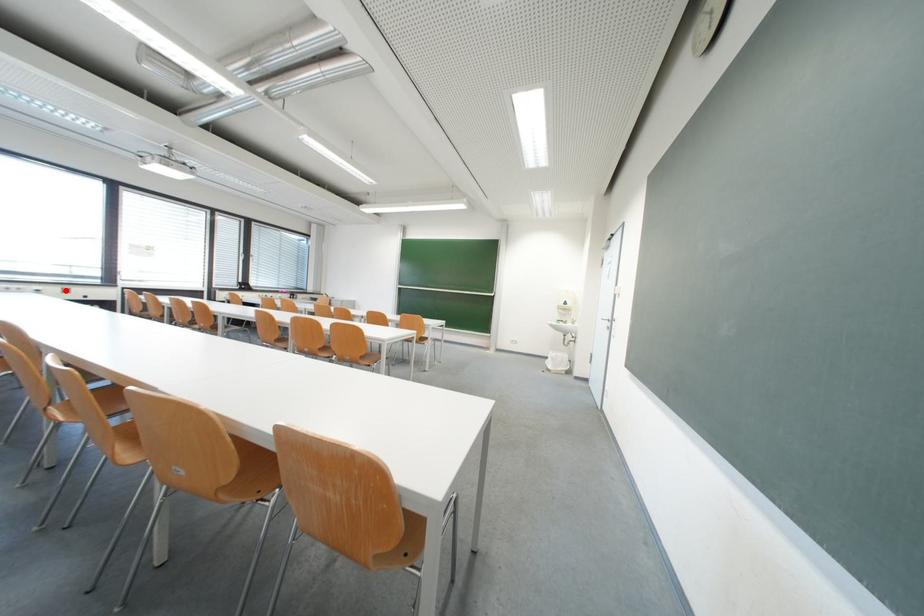
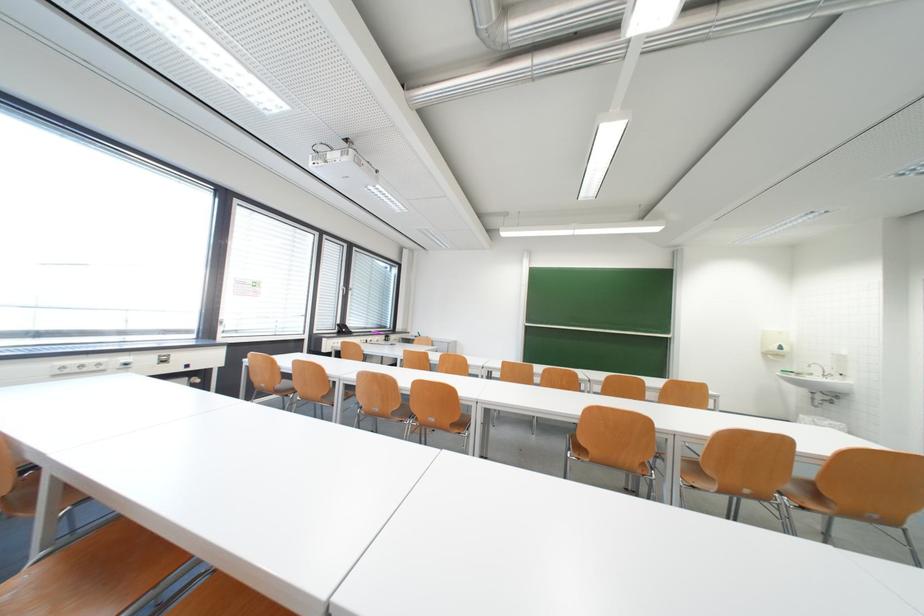
Question: I am providing you with two images of the same scene from different viewpoints. In image1, a red point is highlighted. Considering the same 3D point in image2, which of the following is correct?

Choices:
 (A) It is closer
 (B) It is farther

Answer: (B)